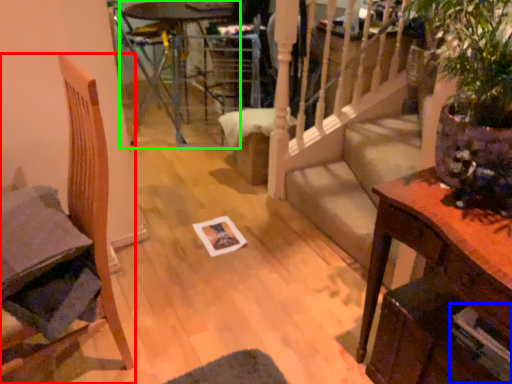
Question: Which object is the farthest from chair (highlighted by a red box)? Choose among these: magazine (highlighted by a blue box) or glass table (highlighted by a green box).

Choices:
 (A) magazine
 (B) glass table

Answer: (B)